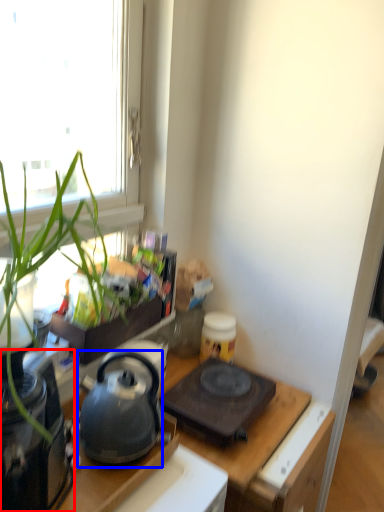
Question: Which object is closer to the camera taking this photo, appliance (highlighted by a red box) or kettle (highlighted by a blue box)?

Choices:
 (A) appliance
 (B) kettle

Answer: (A)